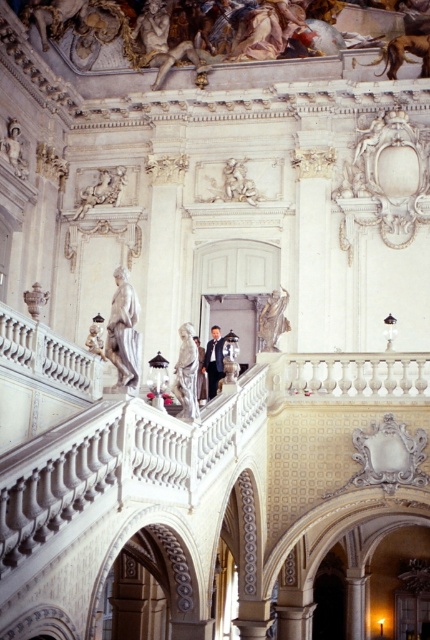
Question: Is white marble statue at upper left closer to camera compared to matte white statue at upper left?

Choices:
 (A) no
 (B) yes

Answer: (B)

Question: Is matte gold statue at upper center smaller than matte white statue at upper left?

Choices:
 (A) no
 (B) yes

Answer: (A)

Question: Is white marble statue at upper left below matte white statue at upper left?

Choices:
 (A) no
 (B) yes

Answer: (B)

Question: Which object is the closest to the matte white statue at upper left?

Choices:
 (A) formal black suit at center
 (B) white marble statue at upper center

Answer: (A)

Question: Based on their relative distances, which object is nearer to the formal black suit at center?

Choices:
 (A) matte white statue at upper left
 (B) matte gold statue at upper center
 (C) white marble statue at upper left
 (D) white marble statue at upper center

Answer: (C)

Question: Which object is positioned closest to the matte gold statue at upper center?

Choices:
 (A) matte white vase at upper left
 (B) matte white statue at upper left
 (C) white marble statue at upper left

Answer: (B)